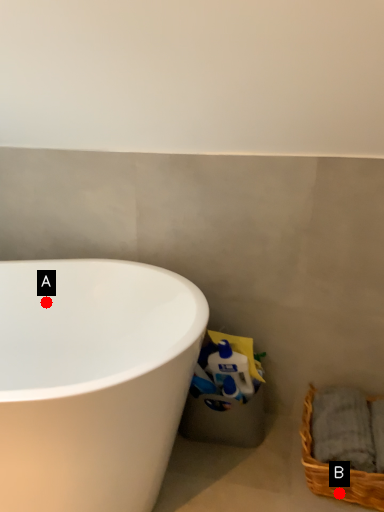
Question: Two points are circled on the image, labeled by A and B beside each circle. Which point is farther from the camera taking this photo?

Choices:
 (A) A is further
 (B) B is further

Answer: (A)